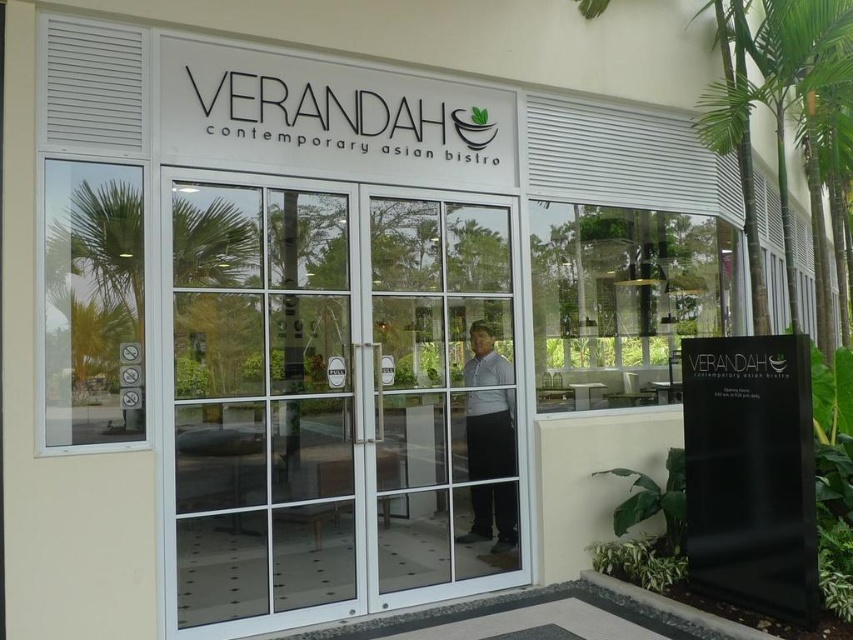
You are a delivery person with a 7.20 inch wide package. You need to deliver it through the entrance of Verandah Contemporary Asian Bistro. Can you fit the package through the gap between the transparent glass door at center and the white glass door at center?

The gap between the transparent glass door at center and the white glass door at center is 6.70 inches. Since the package is 7.20 inches wide, it is wider than the available space. Therefore, the package cannot fit through the gap between the transparent glass door at center and the white glass door at center.

You are standing outside the Verandah Contemporary Asian Bistro and see the white glass door at center and the white shirt at center. Which object is positioned to the left from your perspective?

The white glass door at center is to the left of the white shirt at center.